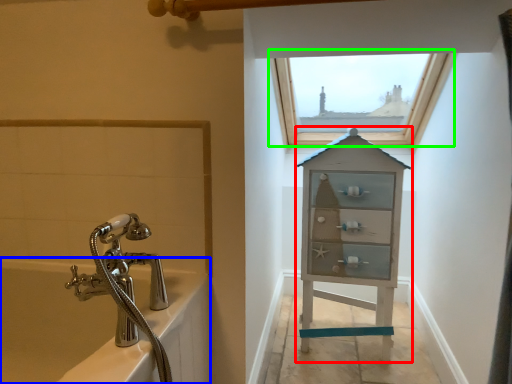
Question: Which is farther away from medicine cabinet (highlighted by a red box)? bath (highlighted by a blue box) or window (highlighted by a green box)?

Choices:
 (A) bath
 (B) window

Answer: (A)